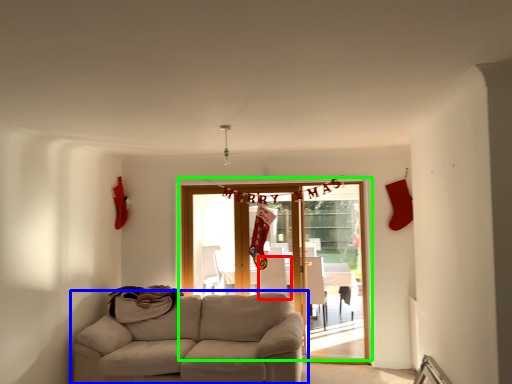
Question: Considering the real-world distances, which object is closest to armchair (highlighted by a red box)? studio couch (highlighted by a blue box) or door (highlighted by a green box).

Choices:
 (A) studio couch
 (B) door

Answer: (B)